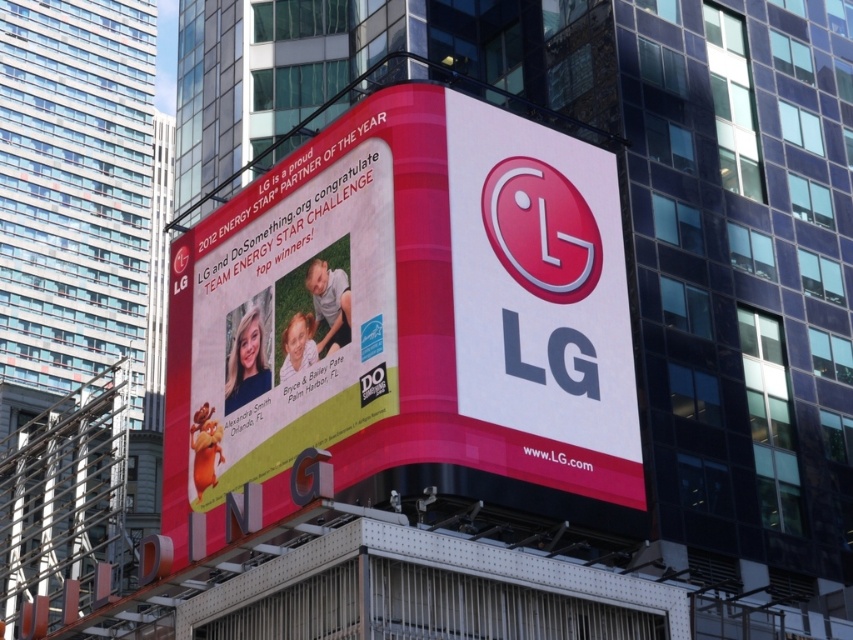
Question: Is matte plastic billboard at center below matte pink banner at center?

Choices:
 (A) yes
 (B) no

Answer: (B)

Question: Is the position of matte plastic billboard at center less distant than that of matte pink banner at center?

Choices:
 (A) no
 (B) yes

Answer: (B)

Question: Which object is farther from the camera taking this photo?

Choices:
 (A) matte pink banner at center
 (B) matte plastic billboard at center

Answer: (A)

Question: Among these objects, which one is farthest from the camera?

Choices:
 (A) matte pink banner at center
 (B) matte plastic billboard at center

Answer: (A)

Question: Does matte plastic billboard at center lie in front of matte pink banner at center?

Choices:
 (A) yes
 (B) no

Answer: (A)